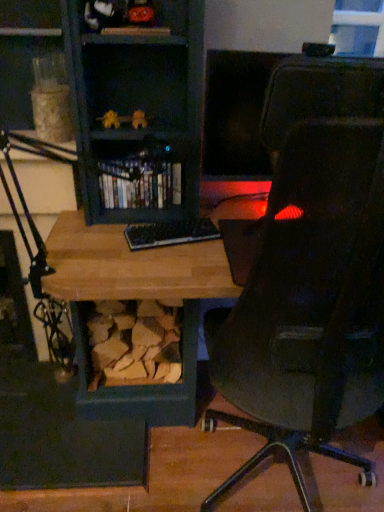
What are the coordinates of `vacant area that is situated to the right of black plastic keyboard at center` in the screenshot? It's located at (224, 242).